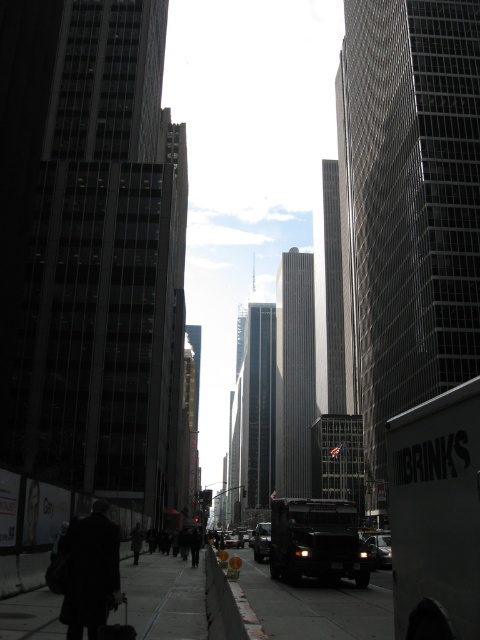
Which of these two, dark asphalt pavement at lower center or dark wool coat at lower left, stands taller?

dark asphalt pavement at lower center

Can you confirm if dark asphalt pavement at lower center is positioned above dark wool coat at lower left?

Incorrect, dark asphalt pavement at lower center is not positioned above dark wool coat at lower left.

The height and width of the screenshot is (640, 480). What are the coordinates of `dark asphalt pavement at lower center` in the screenshot? It's located at (314, 605).

This screenshot has height=640, width=480. What are the coordinates of `dark asphalt pavement at lower center` in the screenshot? It's located at (314, 605).

How much distance is there between metallic silver car at lower right and metallic silver car at center?

A distance of 52.49 meters exists between metallic silver car at lower right and metallic silver car at center.

Can you confirm if metallic silver car at lower right is taller than metallic silver car at center?

No, metallic silver car at lower right is not taller than metallic silver car at center.

Which is behind, point (372, 554) or point (241, 536)?

Point (241, 536)

Identify the location of metallic silver car at lower right. The width and height of the screenshot is (480, 640). (380, 548).

Consider the image. Is dark gray coat at lower left closer to camera compared to metallic silver car at center?

That is True.

Who is more forward, (143,532) or (232,544)?

Point (143,532) is more forward.

Which is behind, point (134, 552) or point (235, 532)?

Positioned behind is point (235, 532).

Find the location of `dark gray coat at lower left`. dark gray coat at lower left is located at coordinates (135, 541).